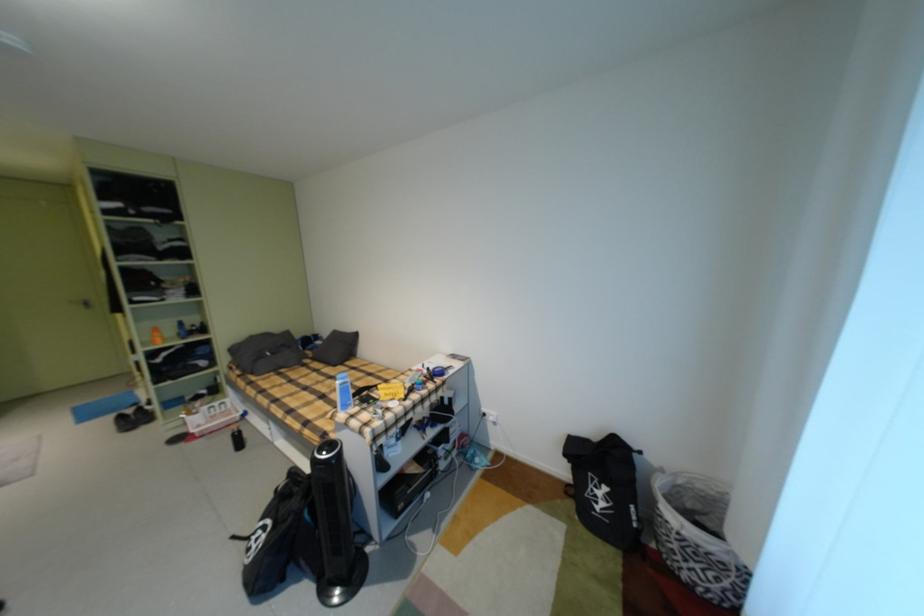
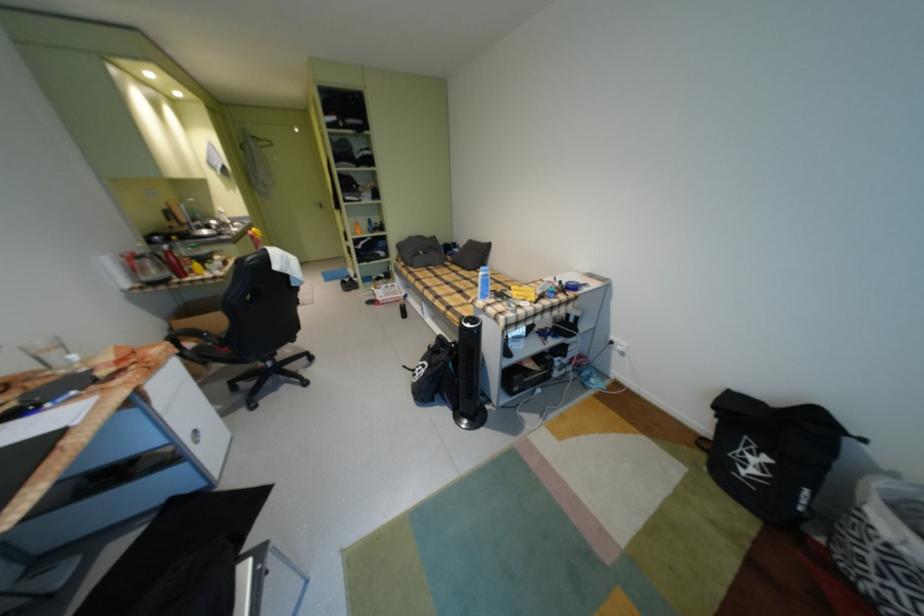
Locate, in the second image, the point that corresponds to (321,351) in the first image.

(459, 256)